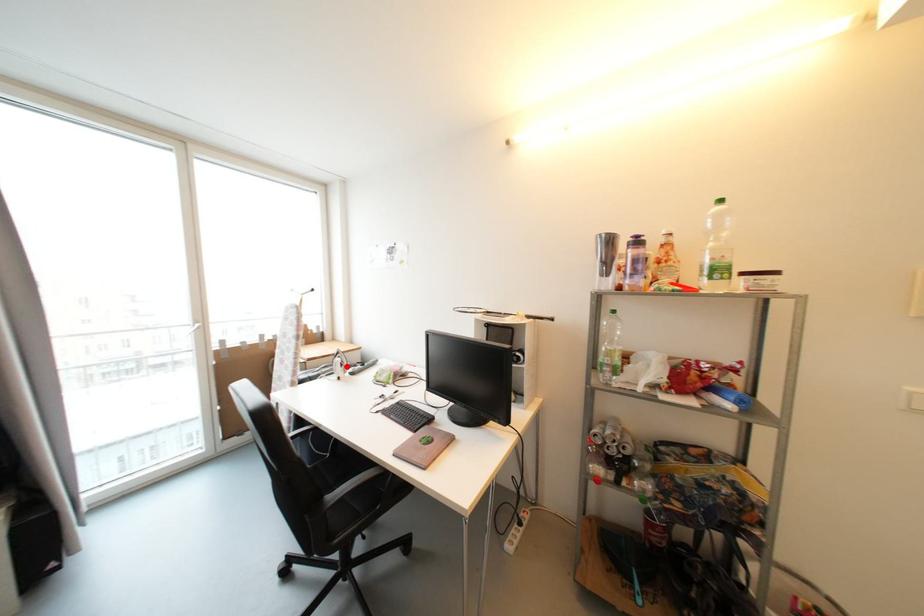
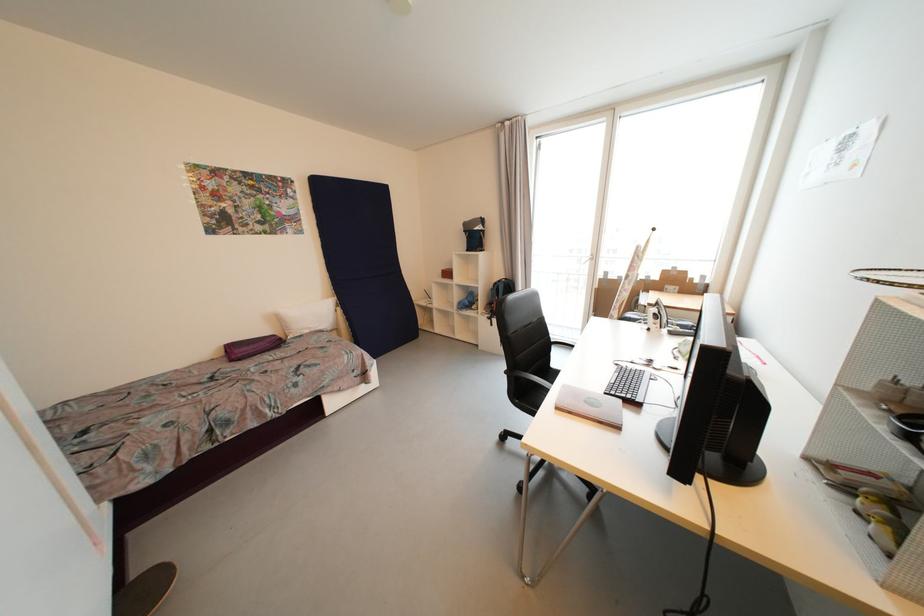
In the second image, find the point that corresponds to the highlighted location in the first image.

(662, 318)